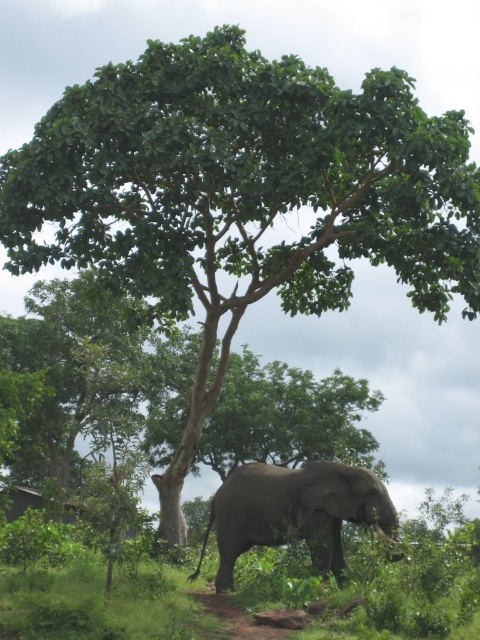
Question: Which object is farther from the camera taking this photo?

Choices:
 (A) green leafy grass at lower center
 (B) green leafy tree at center
 (C) gray matte elephant at lower center

Answer: (B)

Question: Is green leafy grass at lower center smaller than gray matte elephant at lower center?

Choices:
 (A) no
 (B) yes

Answer: (B)

Question: Which of the following is the closest to the observer?

Choices:
 (A) (451, 582)
 (B) (288, 518)

Answer: (A)

Question: Can you confirm if green leafy grass at lower center is thinner than gray matte elephant at lower center?

Choices:
 (A) no
 (B) yes

Answer: (B)

Question: Observing the image, what is the correct spatial positioning of green leafy tree at center in reference to green leafy grass at lower center?

Choices:
 (A) left
 (B) right

Answer: (A)

Question: Which object is positioned farthest from the green leafy grass at lower center?

Choices:
 (A) gray matte elephant at lower center
 (B) green leafy tree at center

Answer: (B)